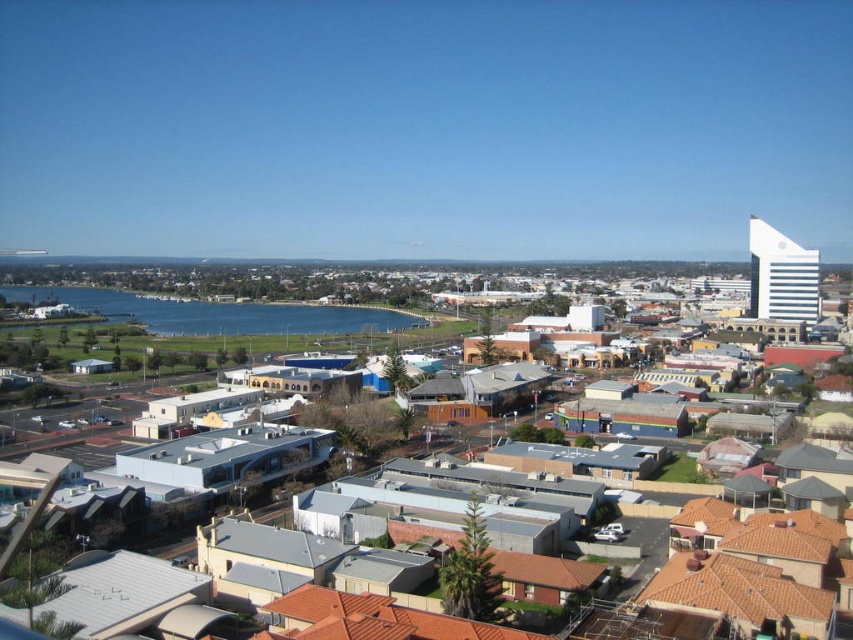
Question: Where is blue water at center located in relation to gray concrete buildings at center in the image?

Choices:
 (A) below
 (B) above

Answer: (B)

Question: Where is blue water at center located in relation to gray concrete buildings at center in the image?

Choices:
 (A) below
 (B) above

Answer: (B)

Question: Is blue water at center closer to camera compared to gray concrete buildings at center?

Choices:
 (A) no
 (B) yes

Answer: (A)

Question: Among these objects, which one is farthest from the camera?

Choices:
 (A) gray concrete buildings at center
 (B) blue water at center

Answer: (B)